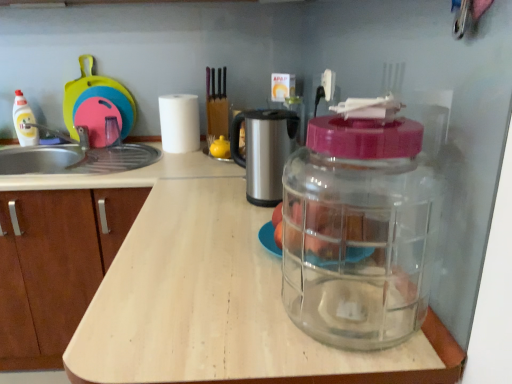
Identify the location of free space above transparent wood countertop at center (from a real-world perspective). (216, 215).